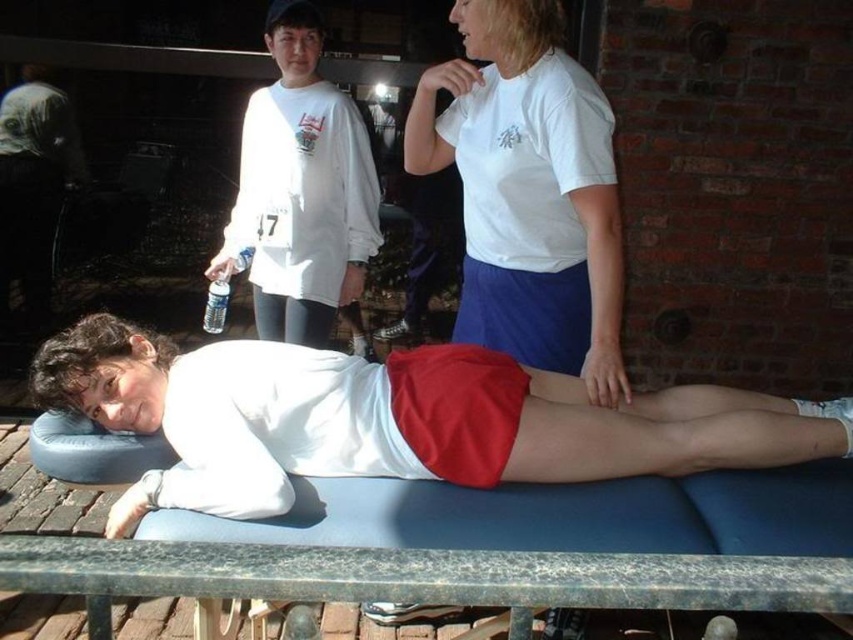
Question: Estimate the real-world distances between objects in this image. Which object is closer to the marbled stone rail at lower center?

Choices:
 (A) white long-sleeved shirt at upper left
 (B) white matte shirt at center

Answer: (B)

Question: Which point is farther to the camera?

Choices:
 (A) marbled stone rail at lower center
 (B) white matte shirt at center
 (C) white long-sleeved shirt at upper left

Answer: (C)

Question: Does white matte shirt at center appear over white cotton t-shirt at upper center?

Choices:
 (A) yes
 (B) no

Answer: (B)

Question: Does white matte shirt at center have a greater width compared to white long-sleeved shirt at upper left?

Choices:
 (A) no
 (B) yes

Answer: (B)

Question: Which of the following is the closest to the observer?

Choices:
 (A) (228, 440)
 (B) (554, 240)

Answer: (A)

Question: From the image, what is the correct spatial relationship of white matte shirt at center in relation to white cotton t-shirt at upper center?

Choices:
 (A) right
 (B) left

Answer: (B)